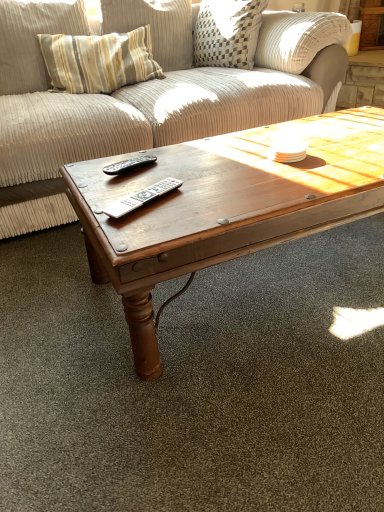
The height and width of the screenshot is (512, 384). I want to click on spots to the right of black plastic remote at center, the first remote from the back, so click(x=195, y=166).